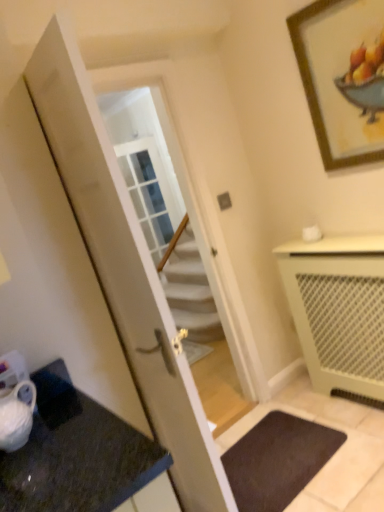
At what (x,y) coordinates should I click in order to perform the action: click on vacant point to the left of beige mesh radiator at lower right. Please return your answer as a coordinate pair (x, y). Looking at the image, I should click on (x=281, y=439).